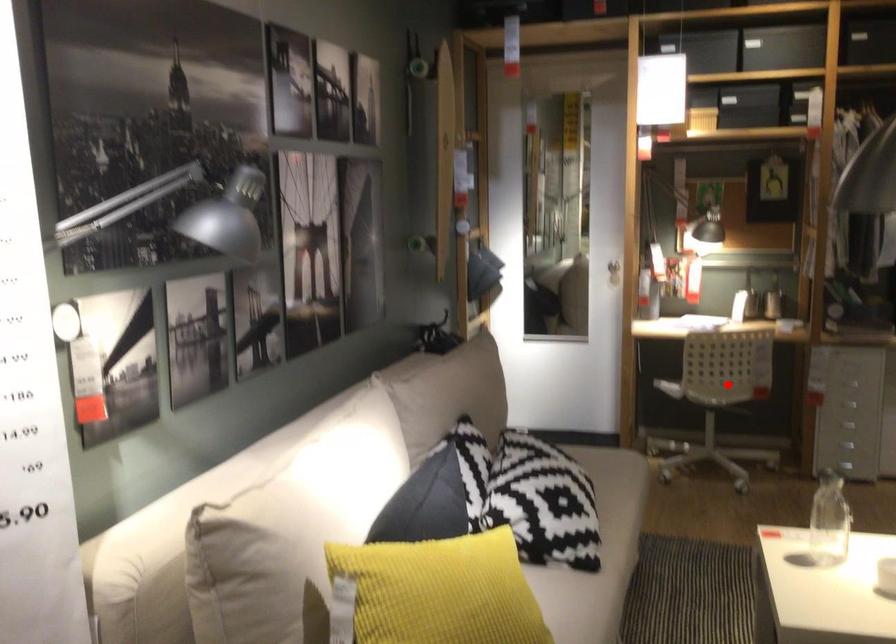
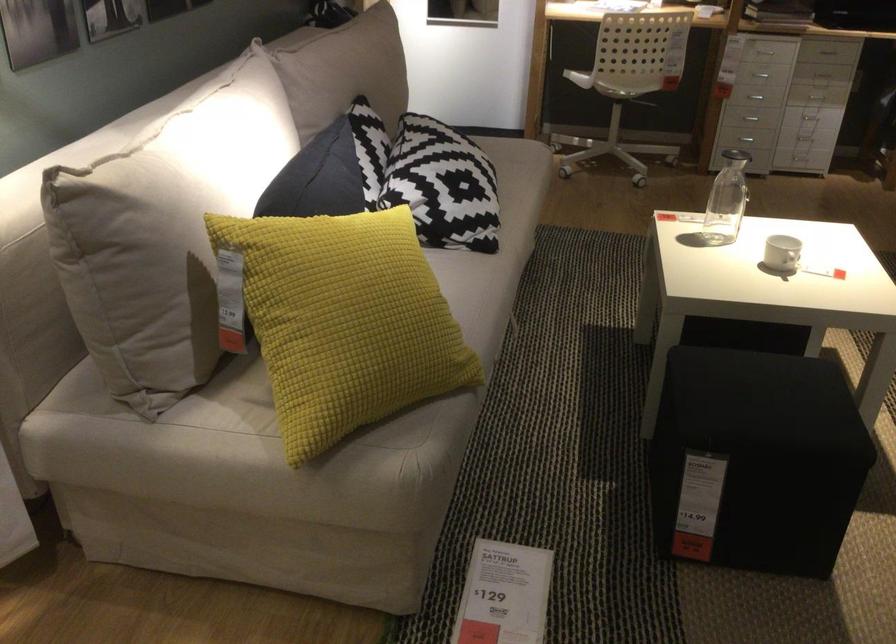
In the second image, find the point that corresponds to the highlighted location in the first image.

(627, 80)